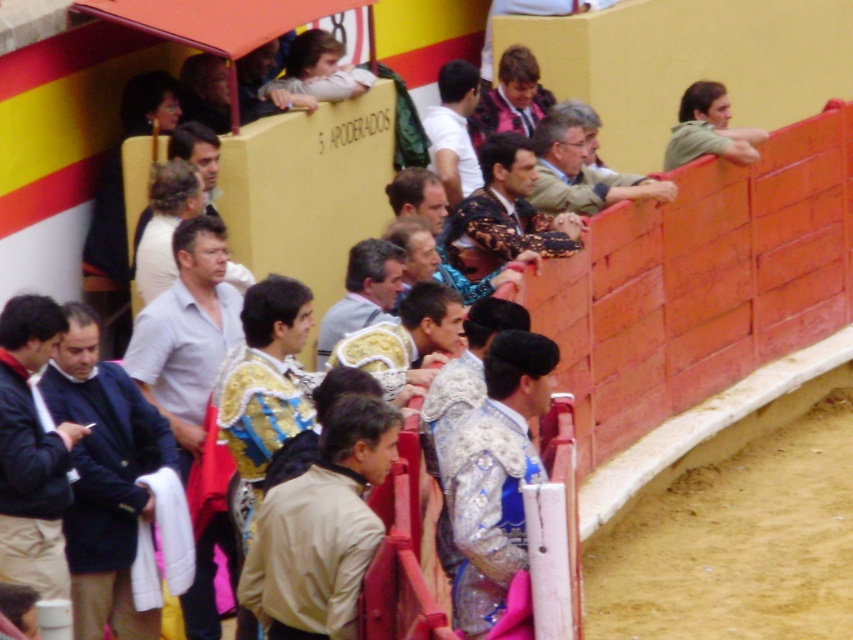
Question: Does dark blue suit at center appear over light brown shirt at center?

Choices:
 (A) no
 (B) yes

Answer: (A)

Question: Does light brown leather jacket at center appear under gold textured vest at center?

Choices:
 (A) yes
 (B) no

Answer: (A)

Question: Which of the following is the closest to the observer?

Choices:
 (A) (315, 520)
 (B) (546, 198)
 (C) (720, 106)
 (D) (444, 156)

Answer: (A)

Question: Is dark blue suit at center bigger than green matte shirt at upper right?

Choices:
 (A) no
 (B) yes

Answer: (B)

Question: Which of the following is the closest to the observer?

Choices:
 (A) (293, 525)
 (B) (64, 444)
 (C) (512, 550)
 (D) (434, 317)

Answer: (A)

Question: Which point is closer to the camera taking this photo?

Choices:
 (A) (553, 344)
 (B) (708, 93)

Answer: (A)